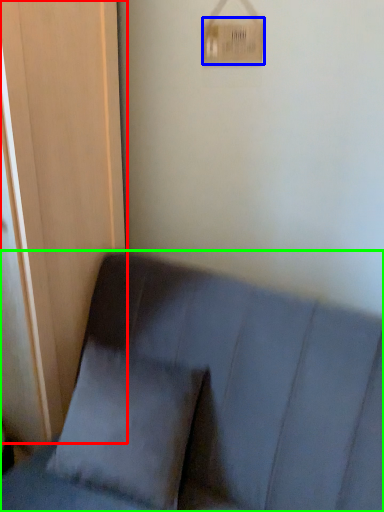
Question: Which object is the closest to the screen door (highlighted by a red box)? Choose among these: light switch (highlighted by a blue box) or furniture (highlighted by a green box).

Choices:
 (A) light switch
 (B) furniture

Answer: (B)